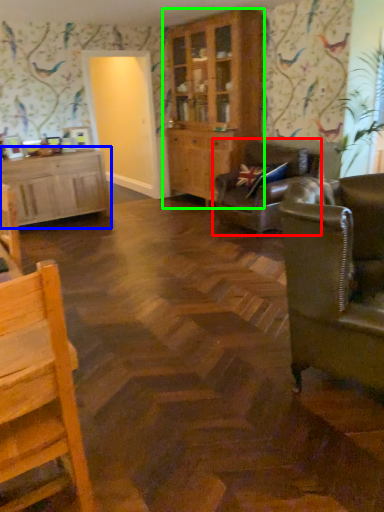
Question: Considering the real-world distances, which object is farthest from studio couch (highlighted by a red box)? cabinetry (highlighted by a blue box) or cabinetry (highlighted by a green box)?

Choices:
 (A) cabinetry
 (B) cabinetry

Answer: (A)